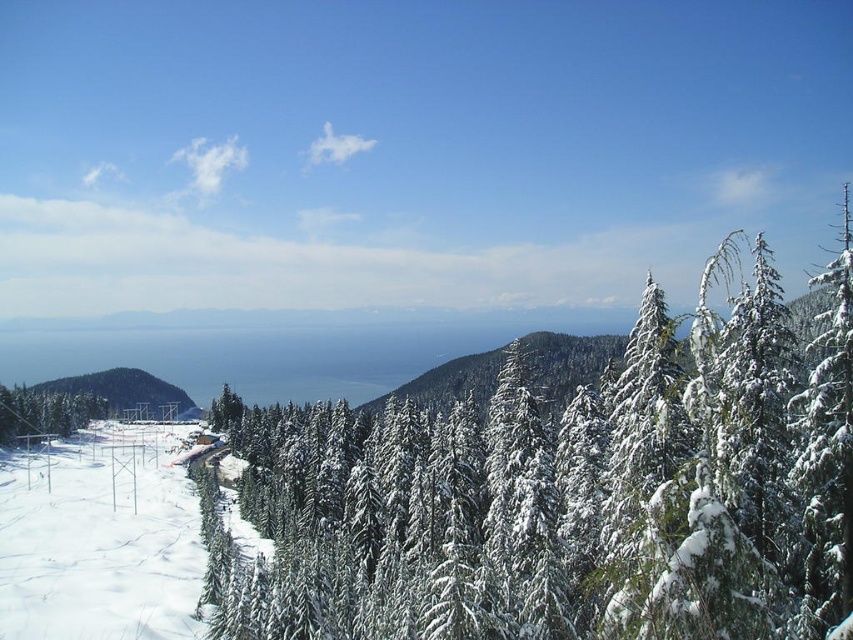
Question: Which of the following is the closest to the observer?

Choices:
 (A) white snow-covered tree at lower left
 (B) white snow ski slope at lower left
 (C) white snow-covered tree at center
 (D) snow-covered hill at center

Answer: (C)

Question: Which object is the farthest from the white snow ski slope at lower left?

Choices:
 (A) snow-covered hill at center
 (B) white snow-covered tree at center
 (C) white snow-covered tree at lower left

Answer: (A)

Question: Estimate the real-world distances between objects in this image. Which object is closer to the white snow-covered tree at center?

Choices:
 (A) white snow ski slope at lower left
 (B) snow-covered hill at center

Answer: (A)

Question: Is white snow-covered tree at center smaller than white snow ski slope at lower left?

Choices:
 (A) yes
 (B) no

Answer: (B)

Question: Does white snow-covered tree at center have a smaller size compared to snow-covered hill at center?

Choices:
 (A) yes
 (B) no

Answer: (B)

Question: Is white snow-covered tree at lower left further to the viewer compared to snow-covered hill at center?

Choices:
 (A) yes
 (B) no

Answer: (B)